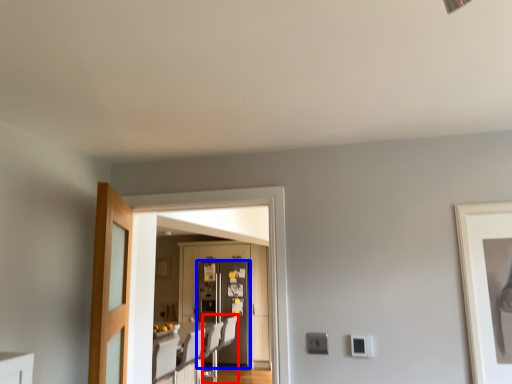
Question: Which object appears farthest to the camera in this image, swivel chair (highlighted by a red box) or refrigerator (highlighted by a blue box)?

Choices:
 (A) swivel chair
 (B) refrigerator

Answer: (B)